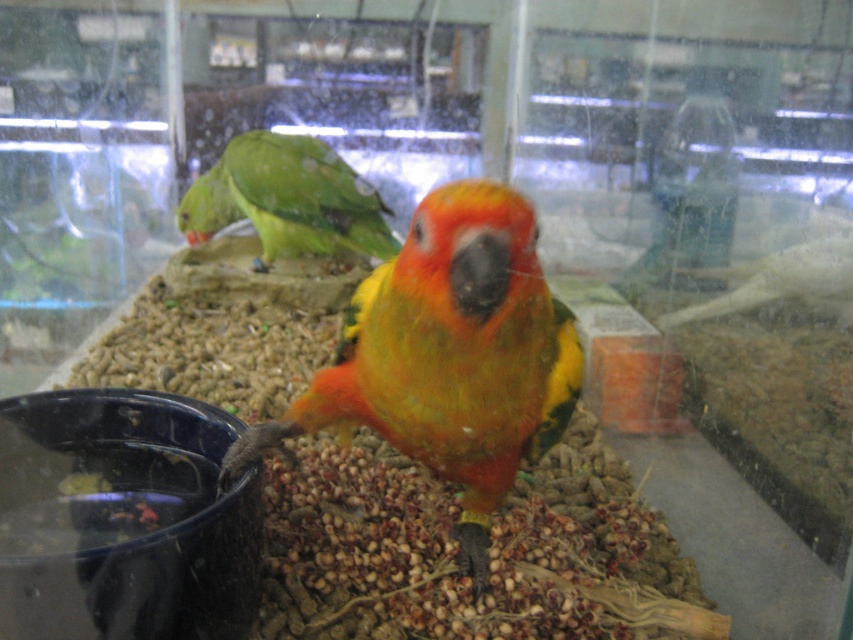
Question: Is yellow-green parrot at center bigger than green matte parrot at upper left?

Choices:
 (A) no
 (B) yes

Answer: (B)

Question: Which object is farther from the camera taking this photo?

Choices:
 (A) yellow-green parrot at center
 (B) green matte parrot at upper left

Answer: (B)

Question: Considering the relative positions of yellow-green parrot at center and green matte parrot at upper left in the image provided, where is yellow-green parrot at center located with respect to green matte parrot at upper left?

Choices:
 (A) right
 (B) left

Answer: (A)

Question: Is yellow-green parrot at center below green matte parrot at upper left?

Choices:
 (A) no
 (B) yes

Answer: (B)